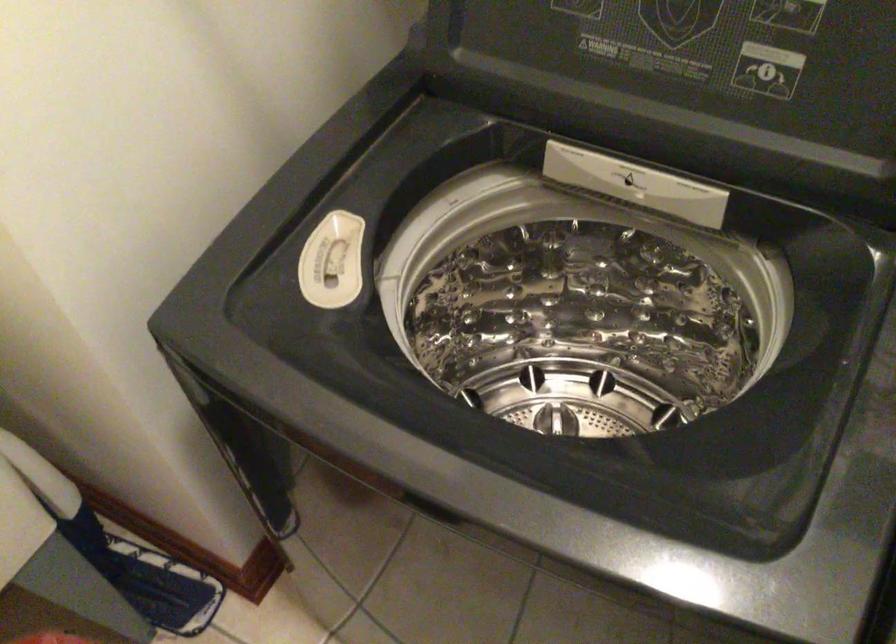
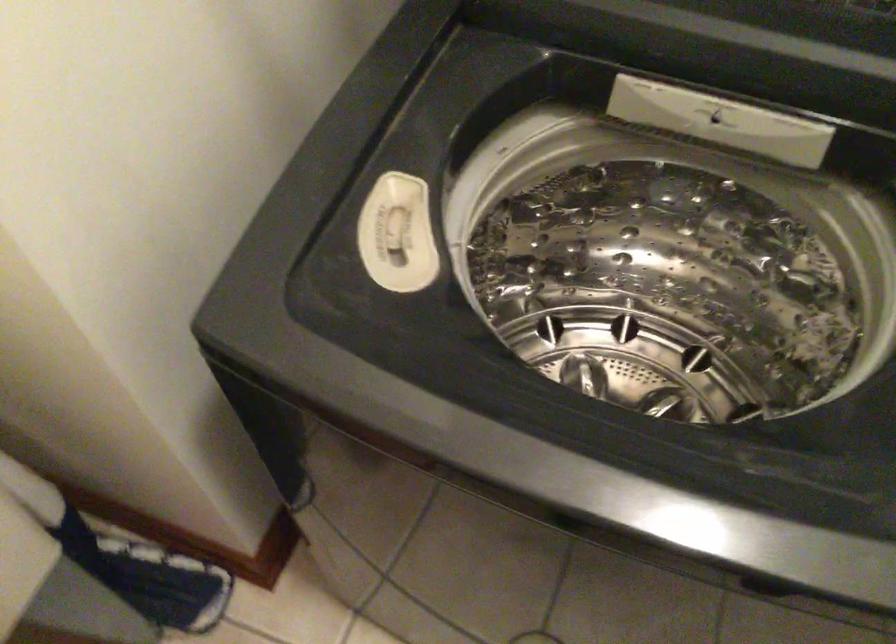
What movement of the cameraman would produce the second image?

The cameraman walked toward left, forward.